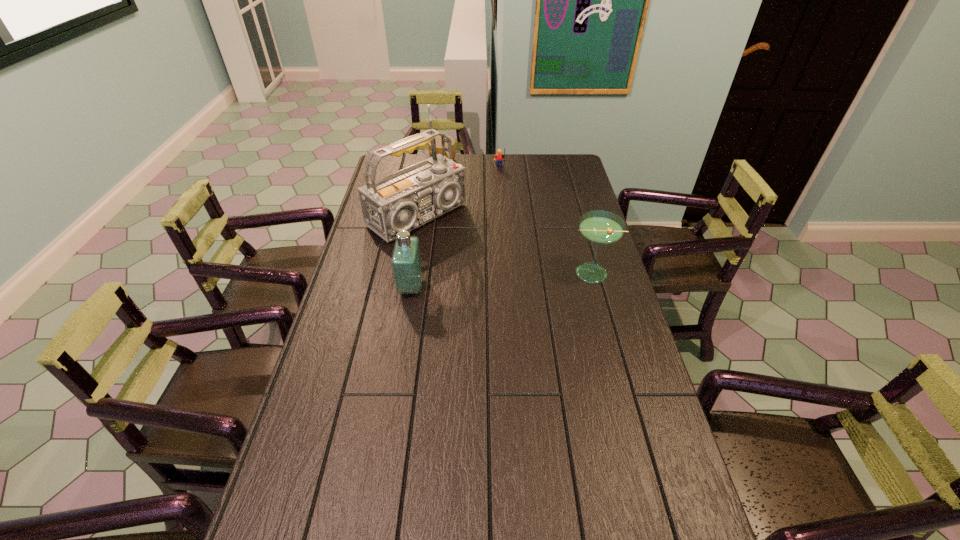
Where is `free space located on the front-facing side of the tallest object`? free space located on the front-facing side of the tallest object is located at coordinates (467, 249).

You are a GUI agent. You are given a task and a screenshot of the screen. Output one action in this format:
    pyautogui.click(x=<x>, y=<y>)
    Task: Click on the free space located on the front-facing side of the tallest object
    
    Given the screenshot: What is the action you would take?
    pyautogui.click(x=458, y=243)

Identify the location of free region located 0.360m on the front-facing side of the tallest object. This screenshot has height=540, width=960. (518, 285).

This screenshot has width=960, height=540. What are the coordinates of `blank area located 0.360m on the front-facing side of the second object from right to left` in the screenshot? It's located at (503, 217).

This screenshot has height=540, width=960. What are the coordinates of `vacant space situated 0.100m on the front-facing side of the second object from right to left` in the screenshot? It's located at (500, 183).

You are a GUI agent. You are given a task and a screenshot of the screen. Output one action in this format:
    pyautogui.click(x=<x>, y=<y>)
    Task: Click on the free spot located 0.380m on the front-facing side of the second object from right to left
    
    Given the screenshot: What is the action you would take?
    pyautogui.click(x=503, y=219)

You are a GUI agent. You are given a task and a screenshot of the screen. Output one action in this format:
    pyautogui.click(x=<x>, y=<y>)
    Task: Click on the vacant area situated 0.330m on the side with the handle of the shortest object
    This screenshot has height=540, width=960.
    Given the screenshot: What is the action you would take?
    tap(456, 211)

The image size is (960, 540). In order to click on vacant area situated on the side with the handle of the shortest object in this screenshot , I will do (451, 194).

The width and height of the screenshot is (960, 540). I want to click on vacant space located 0.050m on the side with the handle of the shortest object, so click(x=446, y=176).

Where is `Lego located in the far edge section of the desktop`? Lego located in the far edge section of the desktop is located at coordinates (499, 157).